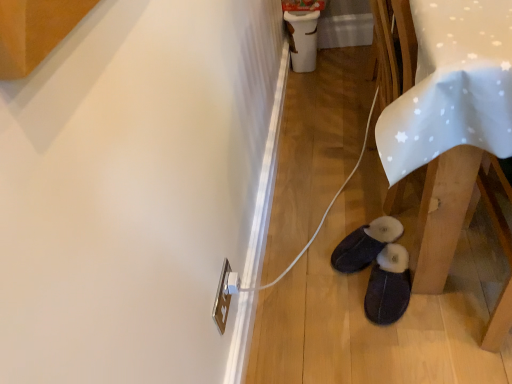
The height and width of the screenshot is (384, 512). I want to click on free space to the left of dark suede slippers at lower center, the 1th footwear from the back, so click(x=313, y=262).